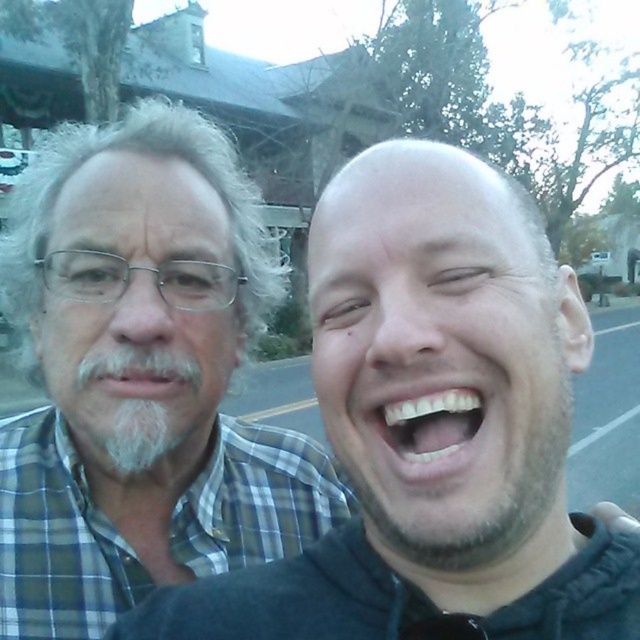
You are standing in the residential area shown in the image. You need to locate the black matte jacket at center. Where exactly is it positioned in the image?

The black matte jacket at center is positioned at point coordinates of (433, 428).

You are a photographer setting up a shoot in this scene. You need to position a spotlight to the right of the gray plaid shirt at left. Will the spotlight shine on the black matte jacket at center?

The black matte jacket at center is to the right of the gray plaid shirt at left, so yes, the spotlight positioned to the right of the gray plaid shirt at left will shine on the black matte jacket at center.